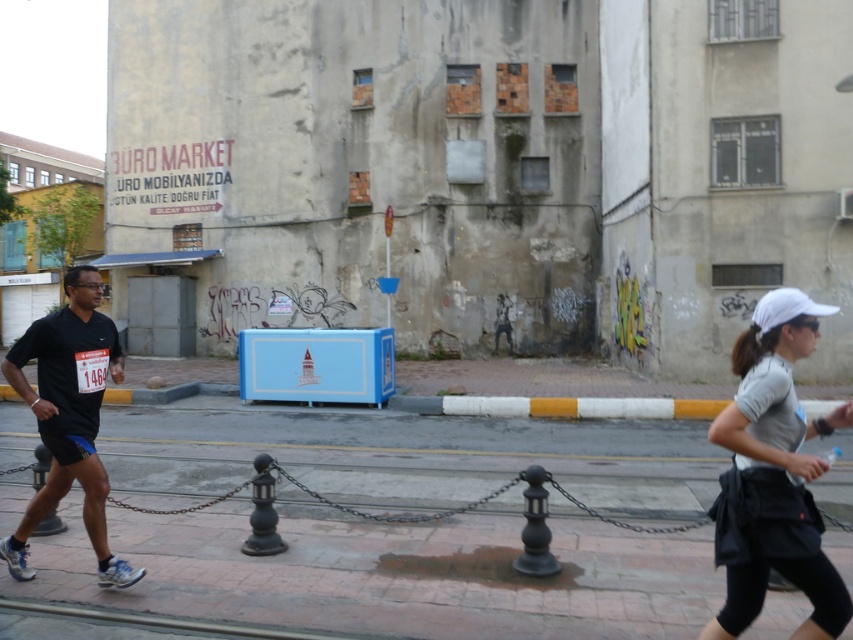
You are standing at the point marked by the coordinates point (393, 572). Looking around, you see the blue kiosk with a white tower logo and the weathered building with the sign. Which direction should you face to see the brick pavement at lower center?

The brick pavement at lower center is represented by point (393, 572), so you are already standing on it. Therefore, you don not need to face any direction to see it as you are already there.

You are a pedestrian trying to cross the street. You see the brick pavement at lower center and the white matte running outfit at right. Which object is closer to you as you look towards the street?

The brick pavement at lower center is closer to you because the white matte running outfit at right is behind it.

You are a pedestrian standing at the curb near the blue kiosk with a white logo. You want to cross the street to reach the weathered building with the sign. There are two people running towards you. One is wearing a white matte running outfit at right and the other is wearing a black matte shirt at left. If the distance between them is 3.61 meters, and you need to decide whether to wait for both to pass before crossing, can you estimate if the space between them is enough to safely step through?

The white matte running outfit at right and black matte shirt at left are 3.61 meters apart from each other. Since the distance between them is over 3 meters, there is sufficient space to safely step through the gap between them while crossing the street.